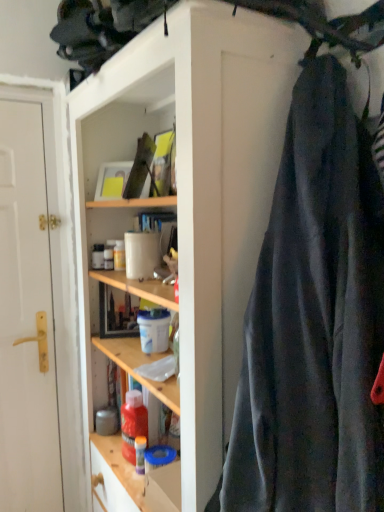
Question: Is point (269, 231) closer or farther from the camera than point (223, 207)?

Choices:
 (A) closer
 (B) farther

Answer: (A)

Question: From a real-world perspective, is dark gray fabric at right above or below wooden shelves at center?

Choices:
 (A) above
 (B) below

Answer: (A)

Question: Which of these objects is positioned closest to the white matte door at left?

Choices:
 (A) wooden shelves at center
 (B) dark gray fabric at right

Answer: (A)

Question: Which object is the closest to the wooden shelves at center?

Choices:
 (A) white matte door at left
 (B) dark gray fabric at right

Answer: (B)